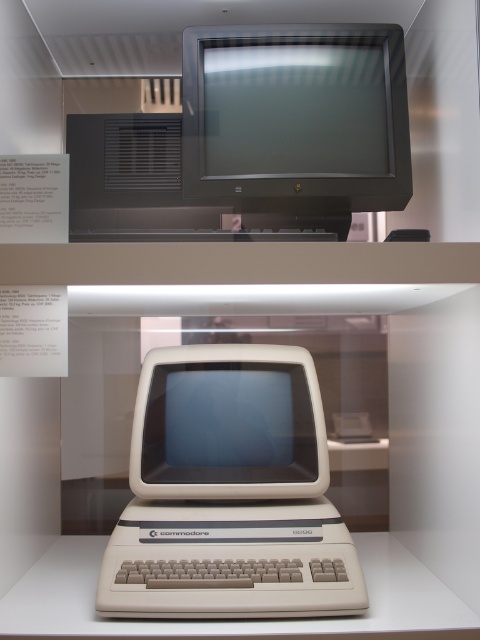
Is beige plastic commodore 64 at center further to camera compared to beige plastic monitor at center?

No, beige plastic commodore 64 at center is closer to the viewer.

Between point (284, 403) and point (247, 388), which one is positioned in front?

Point (284, 403)

The height and width of the screenshot is (640, 480). I want to click on beige plastic commodore 64 at center, so click(x=228, y=492).

Can you confirm if matte black monitor at upper center is taller than beige plastic monitor at center?

Correct, matte black monitor at upper center is much taller as beige plastic monitor at center.

Does matte black monitor at upper center come behind beige plastic monitor at center?

No.

Who is more distant from viewer, (249, 109) or (260, 380)?

The point (260, 380) is more distant.

What are the coordinates of `matte black monitor at upper center` in the screenshot? It's located at (297, 122).

Which is more to the left, beige plastic commodore 64 at center or matte black monitor at upper center?

Positioned to the left is beige plastic commodore 64 at center.

Does beige plastic commodore 64 at center come in front of matte black monitor at upper center?

That is True.

I want to click on beige plastic commodore 64 at center, so click(228, 492).

Locate an element on the screen. beige plastic commodore 64 at center is located at coordinates (228, 492).